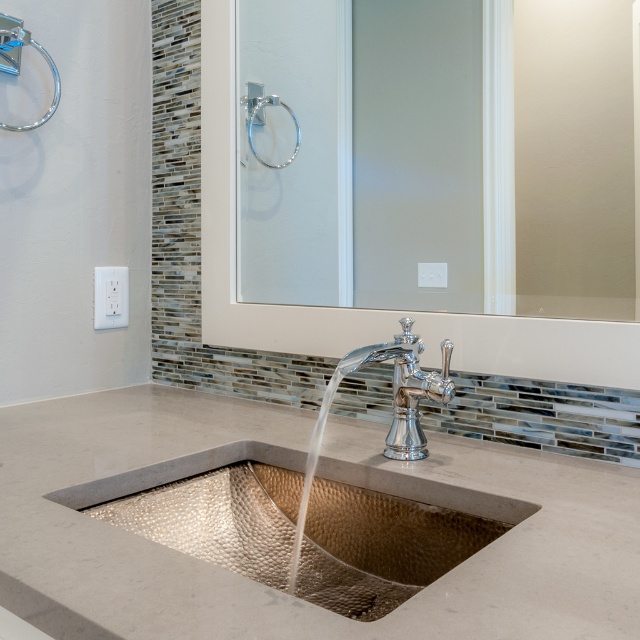
You are designing a layout for a bathroom and need to ensure that the hammered copper sink at center and the clear glass mirror at upper center are placed in a way that the sink doesn not block the mirror. Given their sizes, which object should be placed lower to achieve this?

The hammered copper sink at center has a smaller size compared to the clear glass mirror at upper center. To prevent the sink from blocking the mirror, the sink should be placed lower so that the larger mirror can be positioned above it without obstruction.

You are designing a bathroom layout and need to ensure that the clear glass mirror at upper center can fit above the hammered copper sink at center. Given that the mirror is 1.2 meters wide, is there enough space above the sink to accommodate it?

The hammered copper sink at center has a width larger than the clear glass mirror at upper center. Since the sink is wider, there should be sufficient space above it to place the mirror, which is only 1.2 meters wide.